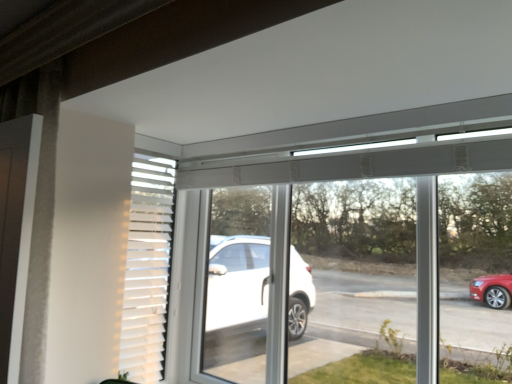
What is the approximate width of white matte shutter at upper center?

It is 9.70 centimeters.

This screenshot has width=512, height=384. What do you see at coordinates (147, 268) in the screenshot? I see `white matte shutter at upper center` at bounding box center [147, 268].

I want to click on white matte shutter at upper center, so click(x=147, y=268).

Image resolution: width=512 pixels, height=384 pixels. What do you see at coordinates (360, 257) in the screenshot?
I see `transparent glass window at center` at bounding box center [360, 257].

Find the location of a particular element. This screenshot has height=384, width=512. transparent glass window at center is located at coordinates pyautogui.click(x=360, y=257).

Find the location of `white matte shutter at upper center`. white matte shutter at upper center is located at coordinates (147, 268).

Considering the positions of objects white matte shutter at upper center and transparent glass window at center in the image provided, who is more to the left, white matte shutter at upper center or transparent glass window at center?

white matte shutter at upper center.

Is the position of white matte shutter at upper center less distant than that of transparent glass window at center?

No, white matte shutter at upper center is further to the viewer.

Is point (167, 293) closer or farther from the camera than point (301, 230)?

Point (167, 293) is positioned closer to the camera compared to point (301, 230).

From the image's perspective, which one is positioned higher, white matte shutter at upper center or transparent glass window at center?

white matte shutter at upper center appears higher in the image.

From a real-world perspective, does white matte shutter at upper center sit lower than transparent glass window at center?

Actually, white matte shutter at upper center is physically above transparent glass window at center in the real world.

Considering the sizes of objects white matte shutter at upper center and transparent glass window at center in the image provided, who is thinner, white matte shutter at upper center or transparent glass window at center?

With smaller width is white matte shutter at upper center.

Considering the sizes of white matte shutter at upper center and transparent glass window at center in the image, is white matte shutter at upper center taller or shorter than transparent glass window at center?

Considering their sizes, white matte shutter at upper center has less height than transparent glass window at center.

From the picture: Is white matte shutter at upper center smaller than transparent glass window at center?

Indeed, white matte shutter at upper center has a smaller size compared to transparent glass window at center.

Do you think white matte shutter at upper center is within transparent glass window at center, or outside of it?

white matte shutter at upper center can be found inside transparent glass window at center.

Is white matte shutter at upper center not close to transparent glass window at center?

They are positioned close to each other.

Is white matte shutter at upper center aimed at transparent glass window at center?

Yes.

Can you tell me how much white matte shutter at upper center and transparent glass window at center differ in facing direction?

The facing directions of white matte shutter at upper center and transparent glass window at center are 90 degrees apart.

You are a GUI agent. You are given a task and a screenshot of the screen. Output one action in this format:
    pyautogui.click(x=<x>, y=<y>)
    Task: Click on the window lying on the right of white matte shutter at upper center
    This screenshot has height=384, width=512.
    Given the screenshot: What is the action you would take?
    pos(360,257)

Considering the relative positions of transparent glass window at center and white matte shutter at upper center in the image provided, is transparent glass window at center to the left of white matte shutter at upper center from the viewer's perspective?

No.

From the picture: Which is in front, transparent glass window at center or white matte shutter at upper center?

transparent glass window at center is closer to the camera.

Between point (379, 171) and point (156, 228), which one is positioned behind?

The point (156, 228) is behind.

From the image's perspective, which object appears higher, transparent glass window at center or white matte shutter at upper center?

white matte shutter at upper center is shown above in the image.

In the scene shown: From a real-world perspective, is transparent glass window at center located beneath white matte shutter at upper center?

Yes, from a real-world perspective, transparent glass window at center is beneath white matte shutter at upper center.

In terms of width, does transparent glass window at center look wider or thinner when compared to white matte shutter at upper center?

Clearly, transparent glass window at center has more width compared to white matte shutter at upper center.

Is transparent glass window at center shorter than white matte shutter at upper center?

In fact, transparent glass window at center may be taller than white matte shutter at upper center.

Can you confirm if transparent glass window at center is bigger than white matte shutter at upper center?

Yes.

Looking at this image, would you say white matte shutter at upper center is part of transparent glass window at center's contents?

Indeed, white matte shutter at upper center is located within transparent glass window at center.

Is transparent glass window at center directly adjacent to white matte shutter at upper center?

There is a gap between transparent glass window at center and white matte shutter at upper center.

Is transparent glass window at center positioned with its back to white matte shutter at upper center?

That's not correct — transparent glass window at center is not looking away from white matte shutter at upper center.

You are a GUI agent. You are given a task and a screenshot of the screen. Output one action in this format:
    pyautogui.click(x=<x>, y=<y>)
    Task: Click on the shutter above the transparent glass window at center (from the image's perspective)
    The height and width of the screenshot is (384, 512).
    Given the screenshot: What is the action you would take?
    pyautogui.click(x=147, y=268)

Identify the location of window lying below the white matte shutter at upper center (from the image's perspective). (360, 257).

At what (x,y) coordinates should I click in order to perform the action: click on shutter above the transparent glass window at center (from a real-world perspective). Please return your answer as a coordinate pair (x, y). The image size is (512, 384). Looking at the image, I should click on (147, 268).